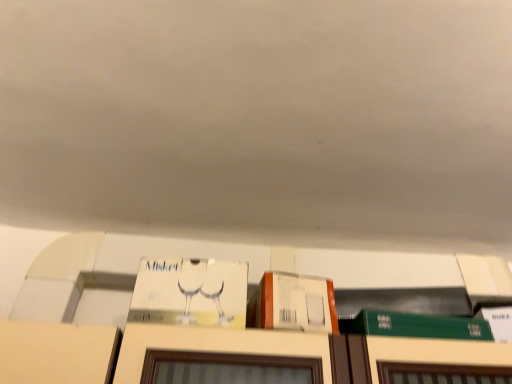
Question: Is white cardboard box at center, the second book viewed from the right, looking in the opposite direction of green matte book at lower right, the second book from the left?

Choices:
 (A) no
 (B) yes

Answer: (A)

Question: Is white cardboard box at center, arranged as the 1th book when viewed from the left, at the right side of green matte book at lower right, the second book from the left?

Choices:
 (A) no
 (B) yes

Answer: (A)

Question: Can you confirm if white cardboard box at center, arranged as the 1th book when viewed from the left, is thinner than green matte book at lower right, which is counted as the first book, starting from the right?

Choices:
 (A) yes
 (B) no

Answer: (A)

Question: From the image's perspective, is white cardboard box at center, the second book viewed from the right, under green matte book at lower right, which is counted as the first book, starting from the right?

Choices:
 (A) no
 (B) yes

Answer: (A)

Question: Is white cardboard box at center, the second book viewed from the right, further to camera compared to green matte book at lower right, the second book from the left?

Choices:
 (A) no
 (B) yes

Answer: (A)

Question: Is white cardboard box at center, arranged as the 1th book when viewed from the left, inside the boundaries of orange matte cardboard box at upper center, or outside?

Choices:
 (A) inside
 (B) outside

Answer: (B)

Question: Visually, is white cardboard box at center, the second book viewed from the right, positioned to the left or to the right of orange matte cardboard box at upper center?

Choices:
 (A) right
 (B) left

Answer: (B)

Question: From a real-world perspective, is white cardboard box at center, arranged as the 1th book when viewed from the left, above or below orange matte cardboard box at upper center?

Choices:
 (A) above
 (B) below

Answer: (A)

Question: In terms of size, does white cardboard box at center, arranged as the 1th book when viewed from the left, appear bigger or smaller than orange matte cardboard box at upper center?

Choices:
 (A) big
 (B) small

Answer: (A)

Question: Looking at their shapes, would you say orange matte cardboard box at upper center is wider or thinner than green matte book at lower right, which is counted as the first book, starting from the right?

Choices:
 (A) thin
 (B) wide

Answer: (A)

Question: Considering the positions of orange matte cardboard box at upper center and green matte book at lower right, the second book from the left, in the image, is orange matte cardboard box at upper center taller or shorter than green matte book at lower right, the second book from the left,?

Choices:
 (A) short
 (B) tall

Answer: (B)

Question: From a real-world perspective, relative to green matte book at lower right, the second book from the left, is orange matte cardboard box at upper center vertically above or below?

Choices:
 (A) below
 (B) above

Answer: (B)

Question: From the image's perspective, relative to green matte book at lower right, which is counted as the first book, starting from the right, is orange matte cardboard box at upper center above or below?

Choices:
 (A) above
 (B) below

Answer: (A)

Question: Is orange matte cardboard box at upper center taller or shorter than white cardboard box at center, the second book viewed from the right?

Choices:
 (A) tall
 (B) short

Answer: (B)

Question: Visually, is orange matte cardboard box at upper center positioned to the left or to the right of white cardboard box at center, arranged as the 1th book when viewed from the left?

Choices:
 (A) right
 (B) left

Answer: (A)